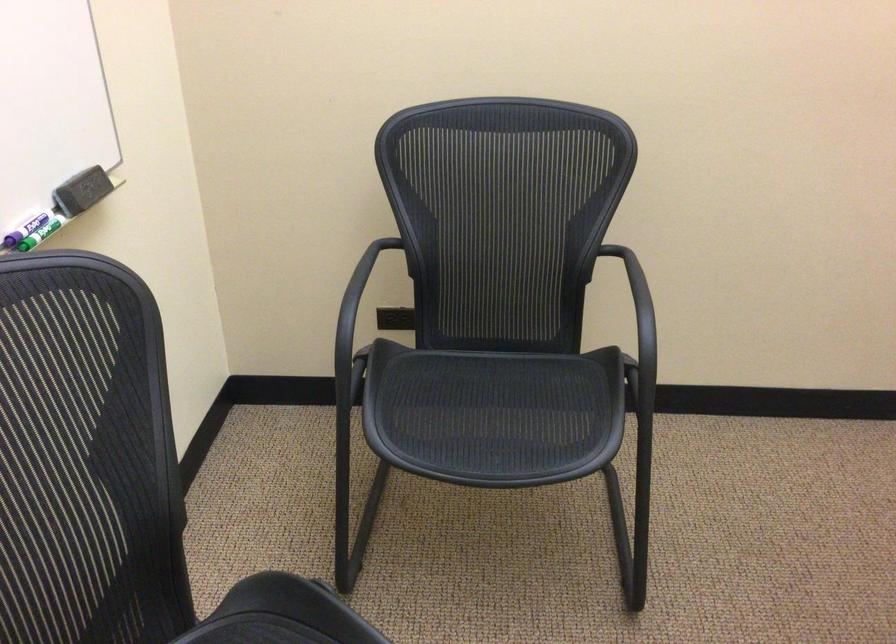
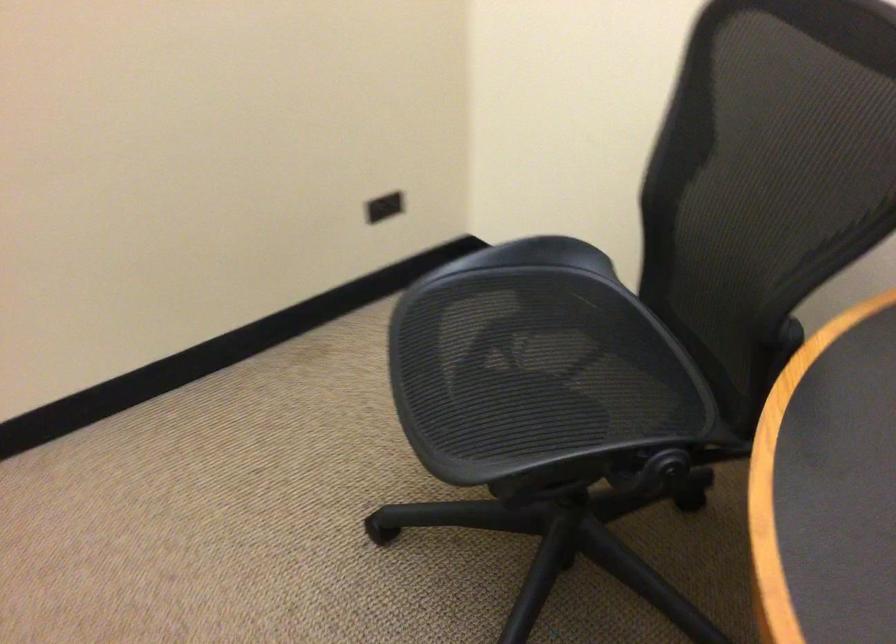
Question: The first image is from the beginning of the video and the second image is from the end. How did the camera likely rotate when shooting the video?

Choices:
 (A) Left
 (B) Right
 (C) Up
 (D) Down

Answer: (B)